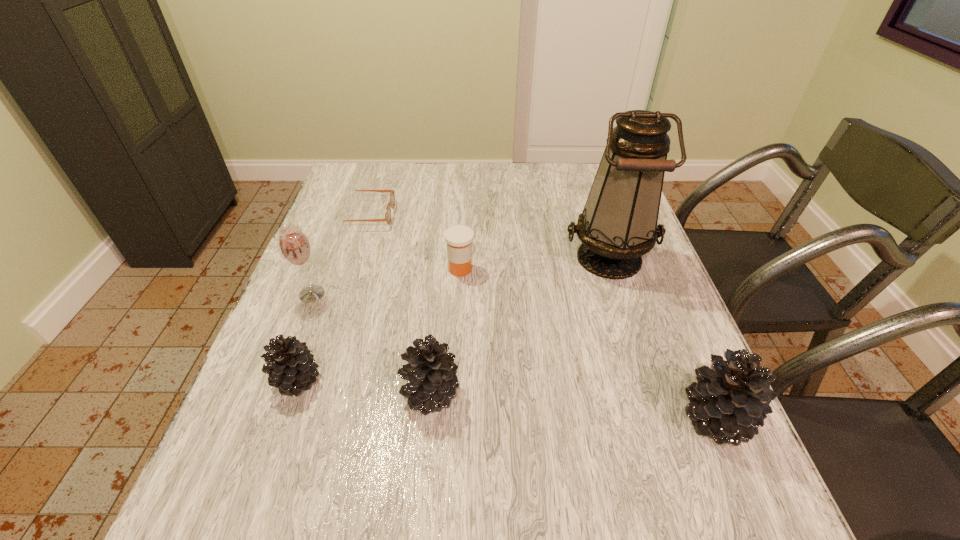
In the image, there is a desktop. Where is `vacant space at the near right corner`? This screenshot has height=540, width=960. vacant space at the near right corner is located at coordinates (659, 455).

At what (x,y) coordinates should I click in order to perform the action: click on vacant space that is in between the rightmost pinecone and the tallest object. Please return your answer as a coordinate pair (x, y). Looking at the image, I should click on (662, 338).

The image size is (960, 540). What are the coordinates of `free space between the medicine and the sunglasses` in the screenshot? It's located at point(413,242).

The image size is (960, 540). Find the location of `free space between the sunglasses and the tallest object`. free space between the sunglasses and the tallest object is located at coordinates (488, 237).

You are a GUI agent. You are given a task and a screenshot of the screen. Output one action in this format:
    pyautogui.click(x=<x>, y=<y>)
    Task: Click on the free spot between the fourth shortest object and the oil lamp
    This screenshot has width=960, height=540.
    Given the screenshot: What is the action you would take?
    pyautogui.click(x=519, y=325)

The width and height of the screenshot is (960, 540). Find the location of `vacant area that lies between the second pinecone from left to right and the oil lamp`. vacant area that lies between the second pinecone from left to right and the oil lamp is located at coordinates (519, 325).

I want to click on free space between the rightmost pinecone and the medicine, so click(588, 344).

I want to click on empty space that is in between the wineglass and the shortest pinecone, so click(x=305, y=337).

Image resolution: width=960 pixels, height=540 pixels. Find the location of `free space between the oil lamp and the leftmost pinecone`. free space between the oil lamp and the leftmost pinecone is located at coordinates (453, 319).

Identify the location of vacant area between the medicine and the oil lamp. This screenshot has width=960, height=540. click(x=535, y=263).